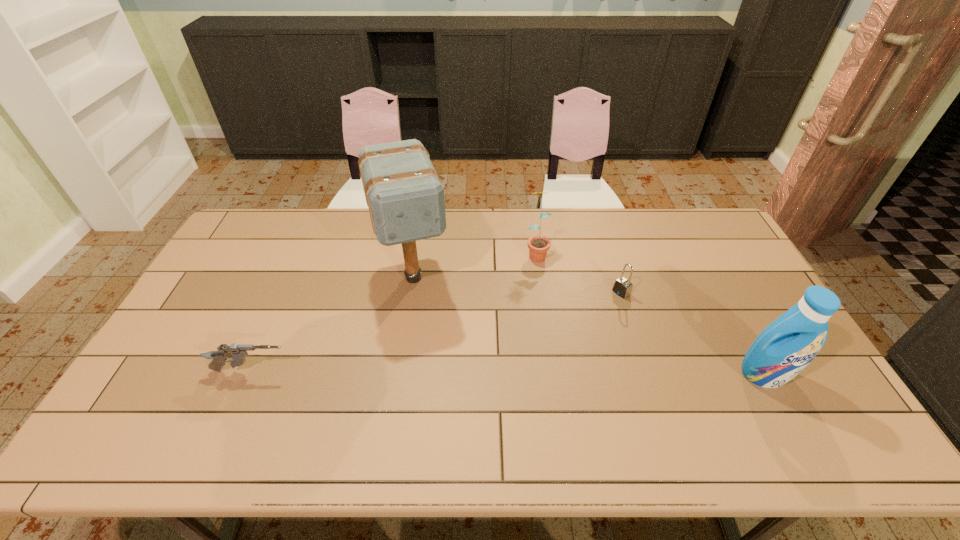
Locate which object ranks fourth in proximity to the padlock. Please provide its 2D coordinates. Your answer should be formatted as a tuple, i.e. [(x, y)], where the tuple contains the x and y coordinates of a point satisfying the conditions above.

[(237, 352)]

Image resolution: width=960 pixels, height=540 pixels. Find the location of `free space that satisfies the following two spatial constraints: 1. on the front side of the third object from right to left; 2. on the left side of the fourth object from left to right`. free space that satisfies the following two spatial constraints: 1. on the front side of the third object from right to left; 2. on the left side of the fourth object from left to right is located at coordinates (541, 293).